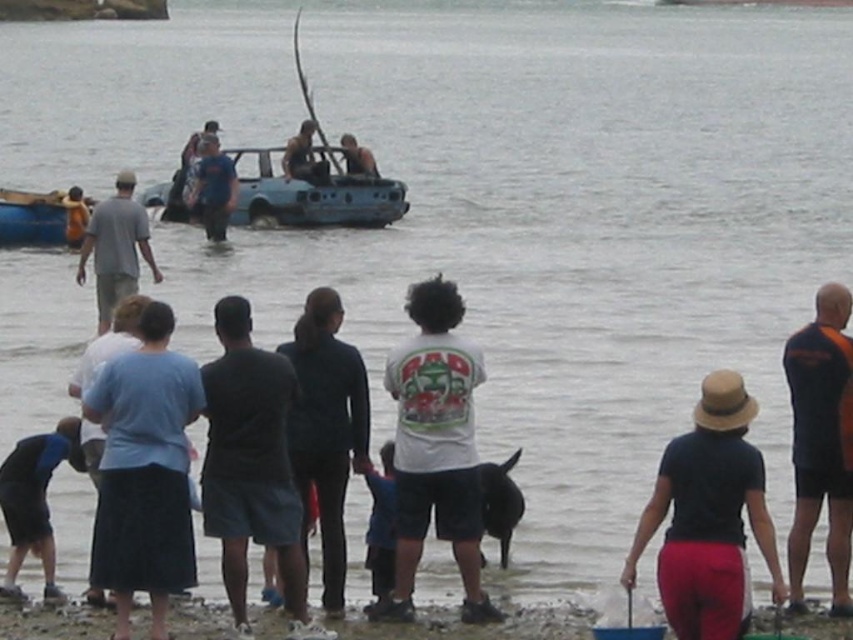
Question: Which of these objects is positioned closest to the dark gray shorts at center?

Choices:
 (A) orange shirt at center
 (B) blue plastic boat at left

Answer: (A)

Question: From the image, what is the correct spatial relationship of dark gray shorts at center in relation to blue plastic boat at left?

Choices:
 (A) left
 (B) right

Answer: (B)

Question: Which of the following is the closest to the observer?

Choices:
 (A) (209, 180)
 (B) (248, 308)
 (C) (753, 401)

Answer: (C)

Question: Which of the following is the farthest from the observer?

Choices:
 (A) light blue fabric shirt at lower left
 (B) blue matte car at center
 (C) orange shirt at center

Answer: (B)

Question: Can you confirm if blue matte car at center is positioned below gray cotton shirt at center?

Choices:
 (A) no
 (B) yes

Answer: (A)

Question: Can you confirm if blue fabric shirt at center is thinner than orange shirt at center?

Choices:
 (A) yes
 (B) no

Answer: (B)